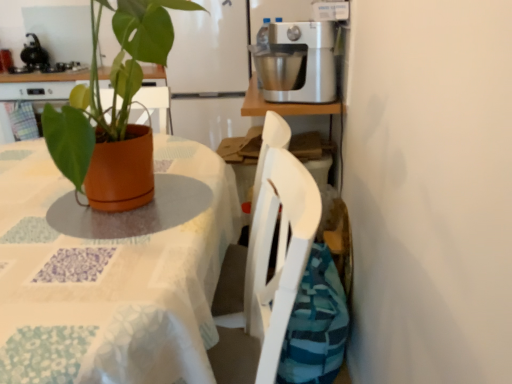
Question: Does satin silver mixer at upper right turn towards terracotta pot at left?

Choices:
 (A) yes
 (B) no

Answer: (B)

Question: From the image's perspective, is satin silver mixer at upper right below terracotta pot at left?

Choices:
 (A) yes
 (B) no

Answer: (B)

Question: Is terracotta pot at left located within satin silver mixer at upper right?

Choices:
 (A) no
 (B) yes

Answer: (A)

Question: From a real-world perspective, is satin silver mixer at upper right positioned over terracotta pot at left based on gravity?

Choices:
 (A) yes
 (B) no

Answer: (A)

Question: Is satin silver mixer at upper right far from terracotta pot at left?

Choices:
 (A) yes
 (B) no

Answer: (B)

Question: Is satin silver mixer at upper right turned away from terracotta pot at left?

Choices:
 (A) yes
 (B) no

Answer: (B)

Question: Considering the relative positions of brushed metal mixer at upper center and terracotta pot at center in the image provided, is brushed metal mixer at upper center to the right of terracotta pot at center from the viewer's perspective?

Choices:
 (A) yes
 (B) no

Answer: (B)

Question: From the image's perspective, is brushed metal mixer at upper center over terracotta pot at center?

Choices:
 (A) no
 (B) yes

Answer: (B)

Question: Is brushed metal mixer at upper center positioned behind terracotta pot at center?

Choices:
 (A) yes
 (B) no

Answer: (A)

Question: From a real-world perspective, is brushed metal mixer at upper center over terracotta pot at center?

Choices:
 (A) no
 (B) yes

Answer: (A)

Question: Does brushed metal mixer at upper center lie in front of terracotta pot at center?

Choices:
 (A) no
 (B) yes

Answer: (A)

Question: Considering the relative sizes of brushed metal mixer at upper center and terracotta pot at center in the image provided, is brushed metal mixer at upper center thinner than terracotta pot at center?

Choices:
 (A) yes
 (B) no

Answer: (A)

Question: Would you say terracotta pot at center is a long distance from terracotta pot at left?

Choices:
 (A) no
 (B) yes

Answer: (A)